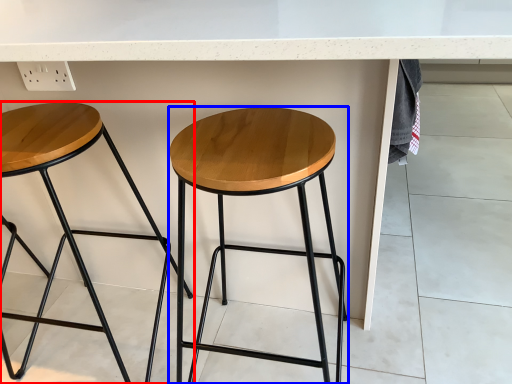
Question: Which of the following is the closest to the observer, stool (highlighted by a red box) or stool (highlighted by a blue box)?

Choices:
 (A) stool
 (B) stool

Answer: (B)